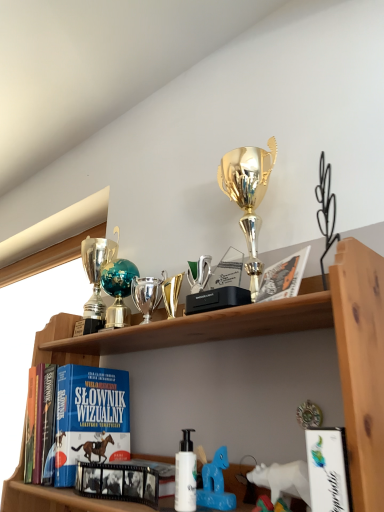
Question: Is there a large distance between blue hardcover book at lower left, arranged as the 3th book when viewed from the front, and white matte bottle at center?

Choices:
 (A) yes
 (B) no

Answer: (B)

Question: Could white matte bottle at center be considered to be inside blue hardcover book at lower left, arranged as the 3th book when viewed from the front?

Choices:
 (A) yes
 (B) no

Answer: (B)

Question: Can you confirm if blue hardcover book at lower left, the third book positioned from the right, is shorter than white matte bottle at center?

Choices:
 (A) no
 (B) yes

Answer: (A)

Question: From the image's perspective, is blue hardcover book at lower left, the third book positioned from the right, beneath white matte bottle at center?

Choices:
 (A) no
 (B) yes

Answer: (B)

Question: Considering the relative sizes of blue hardcover book at lower left, acting as the 1th book starting from the left, and white matte bottle at center in the image provided, is blue hardcover book at lower left, acting as the 1th book starting from the left, thinner than white matte bottle at center?

Choices:
 (A) no
 (B) yes

Answer: (A)

Question: Is white matte bottle at center at the back of blue hardcover book at lower left, arranged as the 3th book when viewed from the front?

Choices:
 (A) no
 (B) yes

Answer: (A)

Question: Is shiny silver trophy at center, which appears as the 2th toy when viewed from the back, wider than white plastic toy horse at lower center, which is counted as the 3th toy, starting from the back?

Choices:
 (A) no
 (B) yes

Answer: (B)

Question: Is shiny silver trophy at center, acting as the 1th toy starting from the top, further to the viewer compared to white plastic toy horse at lower center, which is counted as the 3th toy, starting from the back?

Choices:
 (A) no
 (B) yes

Answer: (B)

Question: From the image's perspective, is shiny silver trophy at center, which is counted as the third toy, starting from the bottom, under white plastic toy horse at lower center, marked as the 3th toy in a left-to-right arrangement?

Choices:
 (A) yes
 (B) no

Answer: (B)

Question: Considering the relative positions of shiny silver trophy at center, which is counted as the third toy, starting from the bottom, and white plastic toy horse at lower center, the 1th toy when ordered from right to left, in the image provided, is shiny silver trophy at center, which is counted as the third toy, starting from the bottom, to the right of white plastic toy horse at lower center, the 1th toy when ordered from right to left, from the viewer's perspective?

Choices:
 (A) no
 (B) yes

Answer: (A)

Question: Is shiny silver trophy at center, the 2th toy in the left-to-right sequence, not inside white plastic toy horse at lower center, marked as the 1th toy in a bottom-to-top arrangement?

Choices:
 (A) yes
 (B) no

Answer: (A)

Question: Considering the relative positions of shiny silver trophy at center, acting as the 1th toy starting from the top, and white plastic toy horse at lower center, marked as the 1th toy in a bottom-to-top arrangement, in the image provided, is shiny silver trophy at center, acting as the 1th toy starting from the top, to the left of white plastic toy horse at lower center, marked as the 1th toy in a bottom-to-top arrangement, from the viewer's perspective?

Choices:
 (A) yes
 (B) no

Answer: (A)

Question: Is white matte bottle at center at the right side of black glossy film strip at center, placed as the 2th book when sorted from left to right?

Choices:
 (A) yes
 (B) no

Answer: (A)